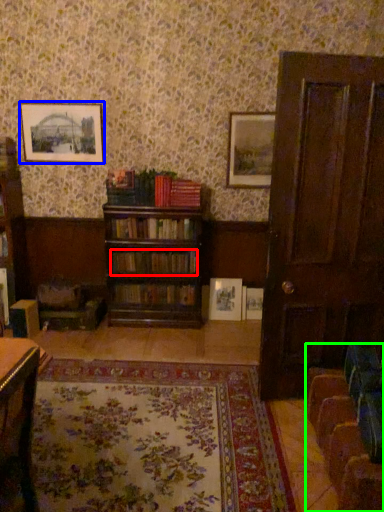
Question: Considering the real-world distances, which object is closest to book (highlighted by a red box)? picture frame (highlighted by a blue box) or swivel chair (highlighted by a green box).

Choices:
 (A) picture frame
 (B) swivel chair

Answer: (A)